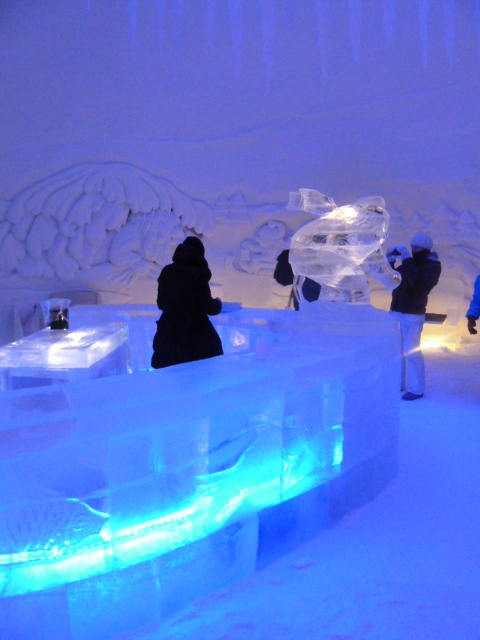
Identify the location of counter. This screenshot has height=640, width=480. (195, 376).